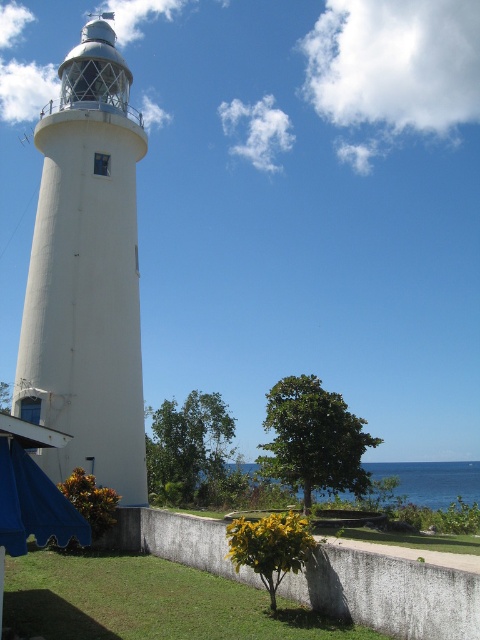
Can you confirm if white matte/lightweight tower at center is smaller than blue water at lower center?

Yes, white matte/lightweight tower at center is smaller than blue water at lower center.

Is white matte/lightweight tower at center behind blue water at lower center?

That is False.

Is point (96, 253) less distant than point (373, 461)?

Yes.

Identify the location of white matte/lightweight tower at center. Image resolution: width=480 pixels, height=640 pixels. (86, 275).